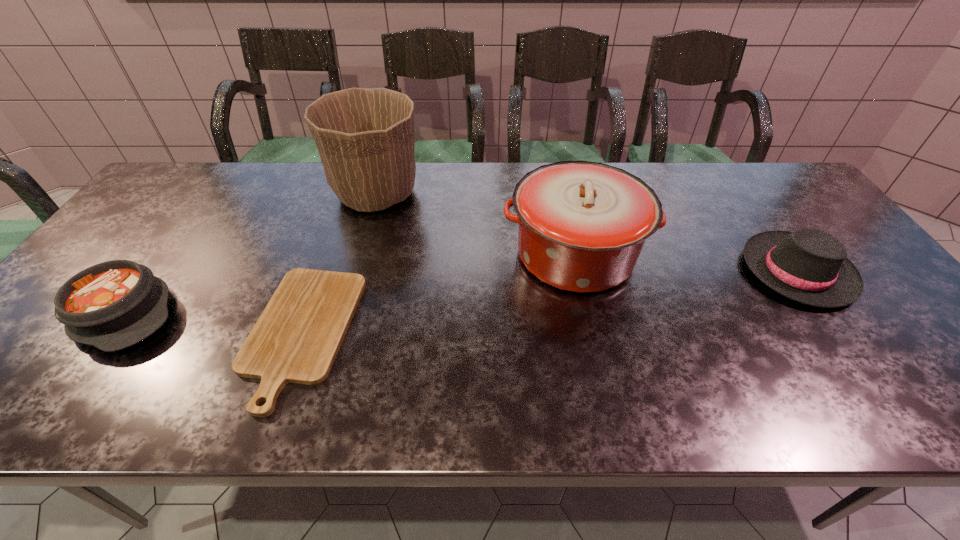
Locate an element on the screen. Image resolution: width=960 pixels, height=540 pixels. vacant space located 0.080m on the right of the shorter casserole is located at coordinates (213, 313).

At what (x,y) coordinates should I click in order to perform the action: click on vacant space located on the back of the chopping board. Please return your answer as a coordinate pair (x, y). Image resolution: width=960 pixels, height=540 pixels. Looking at the image, I should click on (344, 213).

The width and height of the screenshot is (960, 540). I want to click on object located at the far edge, so click(x=365, y=137).

Identify the location of object situated at the near edge. (296, 339).

Locate an element on the screen. The width and height of the screenshot is (960, 540). object located in the left edge section of the desktop is located at coordinates (112, 305).

The height and width of the screenshot is (540, 960). Identify the location of object that is at the right edge. (810, 266).

Locate an element on the screen. The width and height of the screenshot is (960, 540). blank area at the far edge is located at coordinates (481, 195).

Where is `vacant region at the near edge of the desktop`? This screenshot has height=540, width=960. vacant region at the near edge of the desktop is located at coordinates (220, 408).

Image resolution: width=960 pixels, height=540 pixels. I want to click on vacant space at the far left corner of the desktop, so click(162, 195).

In the image, there is a desktop. Identify the location of free space at the near right corner. (952, 392).